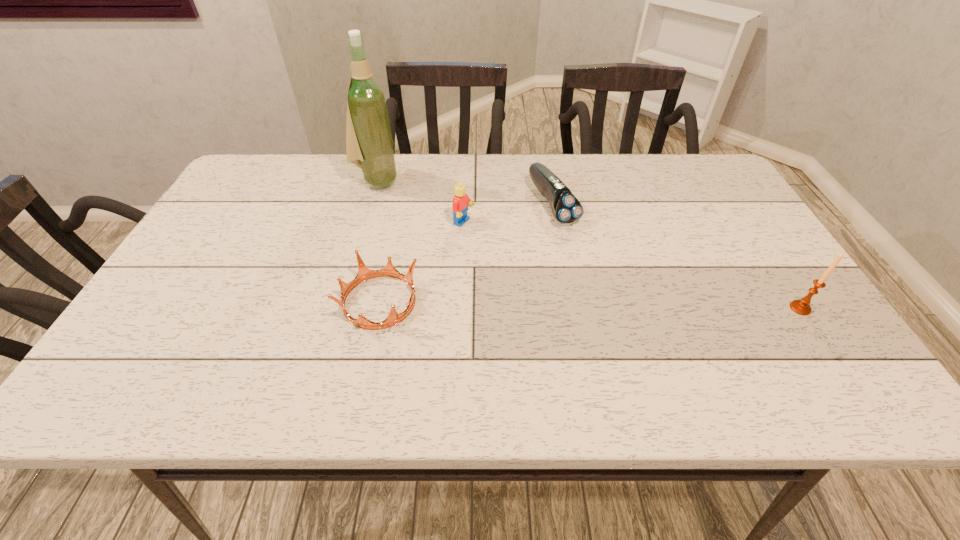
Identify the location of vacant point located between the tallest object and the third tallest object. Image resolution: width=960 pixels, height=540 pixels. (420, 202).

The height and width of the screenshot is (540, 960). In order to click on vacant point located between the tallest object and the candle_holder in this screenshot , I will do click(588, 244).

You are a GUI agent. You are given a task and a screenshot of the screen. Output one action in this format:
    pyautogui.click(x=<x>, y=<y>)
    Task: Click on the free area in between the Lego and the second tallest object
    The image size is (960, 540).
    Given the screenshot: What is the action you would take?
    pyautogui.click(x=633, y=266)

Where is `free space between the Lego and the fourth object from left to right`? This screenshot has height=540, width=960. free space between the Lego and the fourth object from left to right is located at coordinates [509, 213].

Identify the location of empty space that is in between the electric shaver and the crown. (467, 252).

Find the location of a particular element. This screenshot has width=960, height=540. free space between the electric shaver and the Lego is located at coordinates (509, 213).

This screenshot has width=960, height=540. Find the location of `free point between the second object from right to left and the third shortest object`. free point between the second object from right to left and the third shortest object is located at coordinates coord(509,213).

Where is `object that is the second nearest to the tallest object`? The image size is (960, 540). object that is the second nearest to the tallest object is located at coordinates (364, 273).

Find the location of a particular element. The height and width of the screenshot is (540, 960). the third closest object to the Lego is located at coordinates (369, 145).

You are a GUI agent. You are given a task and a screenshot of the screen. Output one action in this format:
    pyautogui.click(x=<x>, y=<y>)
    Task: Click on the vacant space that satisfies the following two spatial constraints: 1. on the front side of the fourth object from left to right; 2. on the left side of the wine bottle
    
    Given the screenshot: What is the action you would take?
    pyautogui.click(x=371, y=204)